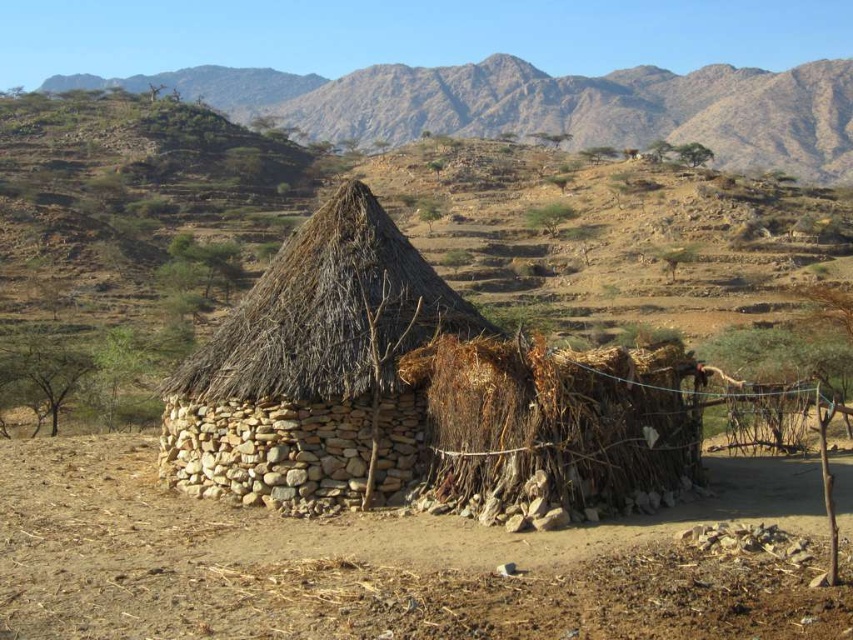
This screenshot has height=640, width=853. What do you see at coordinates (548, 106) in the screenshot? I see `brown rocky mountain at upper center` at bounding box center [548, 106].

Does brown rocky mountain at upper center come behind thatched straw roof at center?

Yes.

Does point (93, 83) lie in front of point (418, 307)?

No.

At what (x,y) coordinates should I click in order to perform the action: click on brown rocky mountain at upper center. Please return your answer as a coordinate pair (x, y). Looking at the image, I should click on (548, 106).

The height and width of the screenshot is (640, 853). I want to click on brown soil at center, so click(372, 563).

Which is behind, point (105, 467) or point (515, 68)?

Positioned behind is point (515, 68).

What do you see at coordinates (372, 563) in the screenshot? I see `brown soil at center` at bounding box center [372, 563].

The height and width of the screenshot is (640, 853). I want to click on brown soil at center, so click(372, 563).

Between brown soil at center and thatched straw roof at center, which one appears on the right side from the viewer's perspective?

Positioned to the right is brown soil at center.

The height and width of the screenshot is (640, 853). Describe the element at coordinates (372, 563) in the screenshot. I see `brown soil at center` at that location.

Locate an element on the screen. This screenshot has height=640, width=853. brown soil at center is located at coordinates pyautogui.click(x=372, y=563).